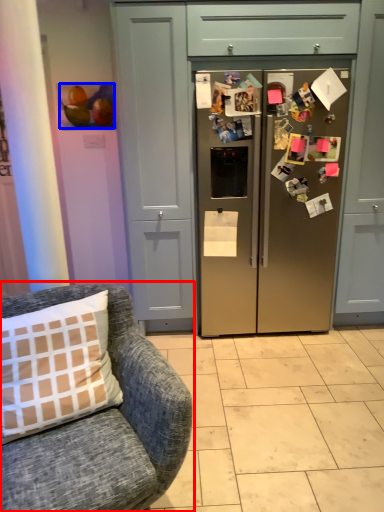
Question: Which of the following is the closest to the observer, chair (highlighted by a red box) or fruit (highlighted by a blue box)?

Choices:
 (A) chair
 (B) fruit

Answer: (A)